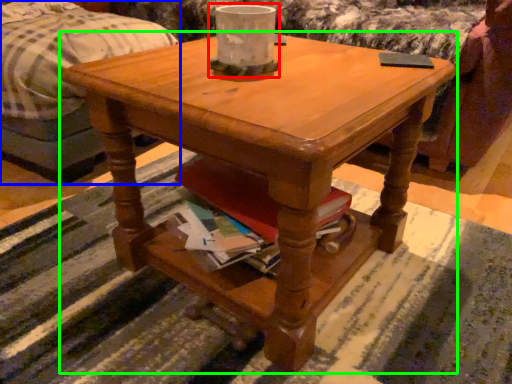
Question: Which object is positioned closest to candle holder (highlighted by a red box)? Select from bed (highlighted by a blue box) and coffee table (highlighted by a green box).

Choices:
 (A) bed
 (B) coffee table

Answer: (B)